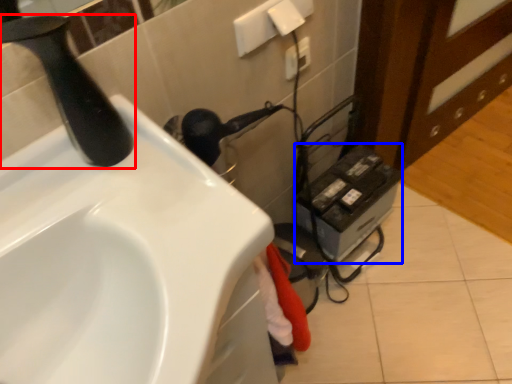
Question: Among these objects, which one is farthest to the camera, tap (highlighted by a red box) or appliance (highlighted by a blue box)?

Choices:
 (A) tap
 (B) appliance

Answer: (B)